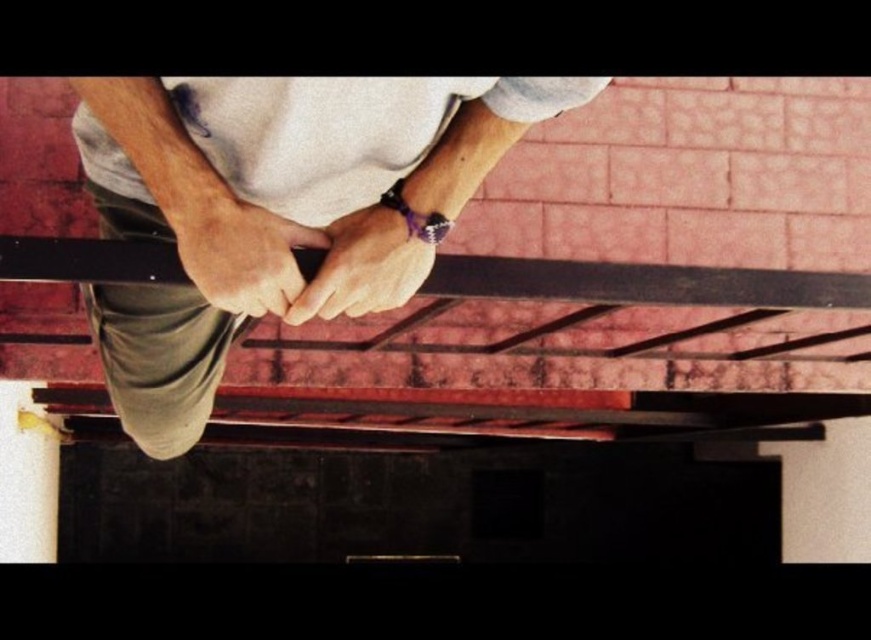
Looking at this image, which of these two, matte black skateboard at center or smooth skin hand at center, stands taller?

Standing taller between the two is matte black skateboard at center.

Is matte black skateboard at center wider than smooth skin hand at center?

Yes.

Between point (132, 406) and point (242, 292), which one is positioned behind?

The point (132, 406) is more distant.

Where is `matte black skateboard at center`? The width and height of the screenshot is (871, 640). matte black skateboard at center is located at coordinates (274, 209).

Can you confirm if smooth skin hand at center is positioned to the right of satin brown leather hand at center?

No, smooth skin hand at center is not to the right of satin brown leather hand at center.

Is point (181, 244) behind point (366, 241)?

That is False.

Find the location of a particular element. The image size is (871, 640). smooth skin hand at center is located at coordinates pyautogui.click(x=238, y=250).

Between matte black skateboard at center and satin brown leather hand at center, which one has less height?

satin brown leather hand at center is shorter.

Is matte black skateboard at center further to the viewer compared to satin brown leather hand at center?

No, it is in front of satin brown leather hand at center.

Describe the element at coordinates (274, 209) in the screenshot. This screenshot has height=640, width=871. I see `matte black skateboard at center` at that location.

Image resolution: width=871 pixels, height=640 pixels. In order to click on matte black skateboard at center in this screenshot , I will do `click(274, 209)`.